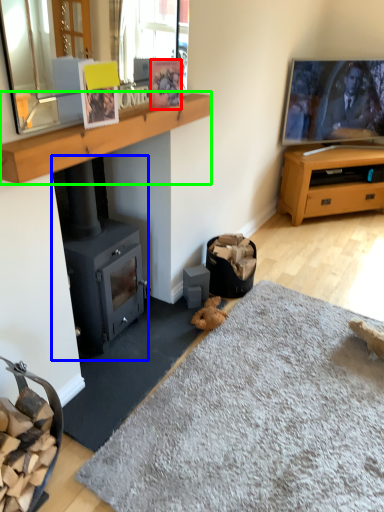
Question: Which is nearer to the picture frame (highlighted by a red box)? wood burning stove (highlighted by a blue box) or mantle (highlighted by a green box).

Choices:
 (A) wood burning stove
 (B) mantle

Answer: (B)